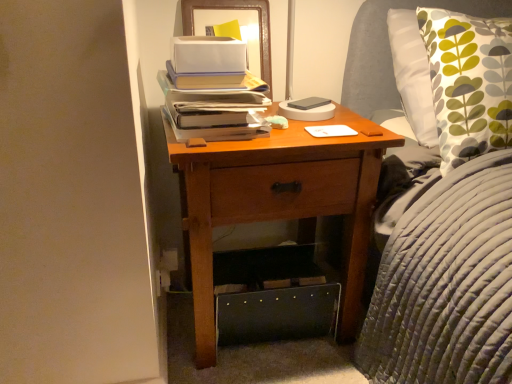
Question: Is matte paper stack of books at center to the left or to the right of white matte notepad at center in the image?

Choices:
 (A) left
 (B) right

Answer: (A)

Question: Based on their sizes in the image, would you say matte paper stack of books at center is bigger or smaller than white matte notepad at center?

Choices:
 (A) small
 (B) big

Answer: (B)

Question: Which object is the closest to the wooden nightstand at center?

Choices:
 (A) wooden framed picture at upper center
 (B) white matte notepad at center
 (C) matte paper stack of books at center

Answer: (C)

Question: Which is nearer to the white matte notepad at center?

Choices:
 (A) wooden framed picture at upper center
 (B) matte paper stack of books at center
 (C) wooden nightstand at center

Answer: (C)